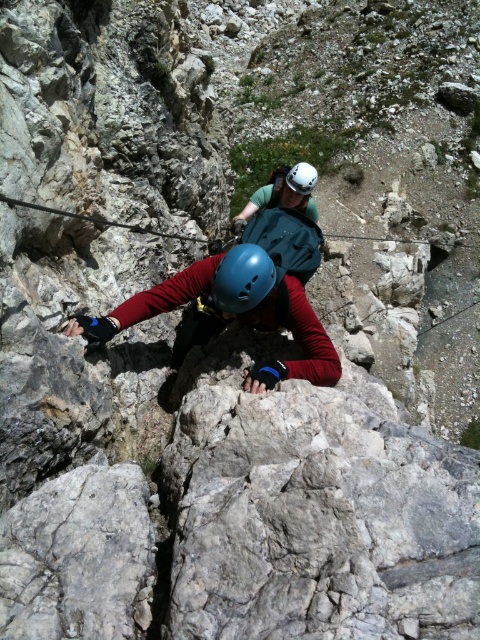
You are a drone operator tasked with capturing aerial footage of the climber wearing a blue helmet. The drone is currently hovering at point A, which is located at coordinates 0.3, 0.5. The blue matte helmet at center is marked by point B at coordinates (241, 280). To ensure the best shot, you need to adjust the drone to fly directly towards the blue matte helmet at center. In which direction should you steer the drone from point A to point B?

The blue matte helmet at center is located at point B with coordinates (241, 280). The drone is at point A with coordinates 0.3, 0.5. To move from A to B, the drone should fly northeast because the x coordinate increases from 0.3 to 0.438 and the y coordinate slightly increases from 0.5 to 0.504.

You are a safety inspector evaluating the climbing gear. You notice two helmets in the scene. Which helmet has a smaller width, the blue matte helmet at center or the white matte helmet at center?

The blue matte helmet at center has a smaller width than the white matte helmet at center according to the description.

Consider the image. You are a safety inspector evaluating the climbing setup. The safety guideline states that climbers must maintain a minimum distance of 3 meters between their helmets for safety. Based on the image, are the blue matte helmet at center and white matte helmet at center meeting this requirement?

The blue matte helmet at center and white matte helmet at center are 3.43 meters apart from each other, which exceeds the minimum required distance of 3 meters. Therefore, they are meeting the safety requirement.